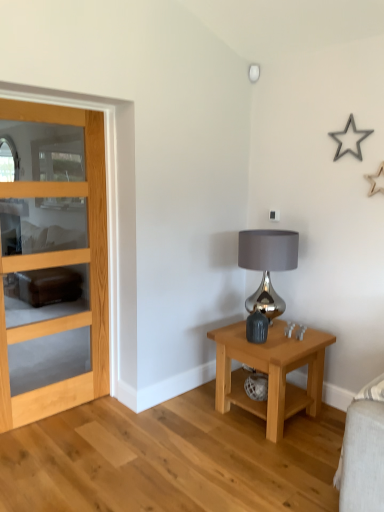
The image size is (384, 512). Describe the element at coordinates (267, 265) in the screenshot. I see `metallic gray lampshade at right` at that location.

Measure the distance between point (262, 407) and camera.

2.79 meters.

Locate an element on the screen. light wood/glass door at left is located at coordinates (62, 264).

Is satin silver lamp at upper center surrounded by light wood/finish nightstand at lower right?

That's incorrect, satin silver lamp at upper center is not inside light wood/finish nightstand at lower right.

In the image, there is a light wood/finish nightstand at lower right. At what (x,y) coordinates should I click in order to perform the action: click on lamp above it (from the image's perspective). Please return your answer as a coordinate pair (x, y). The height and width of the screenshot is (512, 384). Looking at the image, I should click on (254, 72).

How many degrees apart are the facing directions of light wood/finish nightstand at lower right and satin silver lamp at upper center?

The angle between the facing direction of light wood/finish nightstand at lower right and the facing direction of satin silver lamp at upper center is 0.569 degrees.

Who is more distant, metallic gray lampshade at right or satin silver lamp at upper center?

satin silver lamp at upper center is behind.

From the image's perspective, relative to satin silver lamp at upper center, is metallic gray lampshade at right above or below?

From the image's perspective, metallic gray lampshade at right appears below satin silver lamp at upper center.

Considering the sizes of metallic gray lampshade at right and satin silver lamp at upper center in the image, is metallic gray lampshade at right bigger or smaller than satin silver lamp at upper center?

Clearly, metallic gray lampshade at right is larger in size than satin silver lamp at upper center.

Is metallic gray lampshade at right far from satin silver lamp at upper center?

That's right, there is a large distance between metallic gray lampshade at right and satin silver lamp at upper center.

This screenshot has height=512, width=384. In the image, there is a satin silver lamp at upper center. Identify the location of door below it (from a real-world perspective). (62, 264).

From the image's perspective, is satin silver lamp at upper center located above or below light wood/glass door at left?

From the image's perspective, satin silver lamp at upper center appears above light wood/glass door at left.

Considering their positions, is satin silver lamp at upper center located in front of or behind light wood/glass door at left?

satin silver lamp at upper center is behind light wood/glass door at left.

Which point is more forward, (255, 65) or (12, 258)?

The point (12, 258) is closer.

Does light wood/finish nightstand at lower right have a greater width compared to light wood/glass door at left?

Yes.

Where is `door that is above the light wood/finish nightstand at lower right (from the image's perspective)`? door that is above the light wood/finish nightstand at lower right (from the image's perspective) is located at coordinates (62, 264).

Is light wood/finish nightstand at lower right inside or outside of light wood/glass door at left?

light wood/finish nightstand at lower right is outside light wood/glass door at left.

How many degrees apart are the facing directions of light wood/glass door at left and satin silver lamp at upper center?

The angular difference between light wood/glass door at left and satin silver lamp at upper center is 0.42 degrees.

From the picture: Visually, is light wood/glass door at left positioned to the left or to the right of satin silver lamp at upper center?

light wood/glass door at left is to the left of satin silver lamp at upper center.

Which of these two, light wood/glass door at left or satin silver lamp at upper center, stands taller?

light wood/glass door at left is taller.

Is point (278, 259) positioned behind point (13, 269)?

Yes, point (278, 259) is farther from viewer.

From a real-world perspective, which is physically above, metallic gray lampshade at right or light wood/glass door at left?

light wood/glass door at left, from a real-world perspective.

From the image's perspective, which one is positioned higher, metallic gray lampshade at right or light wood/glass door at left?

light wood/glass door at left.

Considering the relative sizes of metallic gray lampshade at right and light wood/glass door at left in the image provided, is metallic gray lampshade at right smaller than light wood/glass door at left?

Indeed, metallic gray lampshade at right has a smaller size compared to light wood/glass door at left.

The width and height of the screenshot is (384, 512). I want to click on table lamp behind the light wood/glass door at left, so click(267, 265).

Is light wood/glass door at left positioned beyond the bounds of metallic gray lampshade at right?

Absolutely, light wood/glass door at left is external to metallic gray lampshade at right.

Is the surface of light wood/glass door at left in direct contact with metallic gray lampshade at right?

No, light wood/glass door at left is not making contact with metallic gray lampshade at right.

From the image's perspective, is light wood/glass door at left located above or below metallic gray lampshade at right?

light wood/glass door at left is situated higher than metallic gray lampshade at right in the image.

Where is `nightstand below the satin silver lamp at upper center (from the image's perspective)`? The height and width of the screenshot is (512, 384). nightstand below the satin silver lamp at upper center (from the image's perspective) is located at coordinates (271, 372).

Identify the location of table lamp that appears below the satin silver lamp at upper center (from a real-world perspective). (267, 265).

Looking at the image, which one is located closer to metallic gray lampshade at right, satin silver lamp at upper center or light wood/glass door at left?

light wood/glass door at left.

Which object lies nearer to the anchor point metallic gray lampshade at right, light wood/glass door at left or light wood/finish nightstand at lower right?

light wood/finish nightstand at lower right is positioned closer to the anchor metallic gray lampshade at right.

Based on their spatial positions, is satin silver lamp at upper center or light wood/finish nightstand at lower right closer to light wood/glass door at left?

The object closer to light wood/glass door at left is light wood/finish nightstand at lower right.

Estimate the real-world distances between objects in this image. Which object is closer to light wood/finish nightstand at lower right, light wood/glass door at left or satin silver lamp at upper center?

light wood/glass door at left is positioned closer to the anchor light wood/finish nightstand at lower right.

Looking at the image, which one is located further to light wood/finish nightstand at lower right, metallic gray lampshade at right or satin silver lamp at upper center?

Based on the image, satin silver lamp at upper center appears to be further to light wood/finish nightstand at lower right.

Looking at this image, considering their positions, is light wood/glass door at left positioned further to metallic gray lampshade at right than satin silver lamp at upper center?

Among the two, satin silver lamp at upper center is located further to metallic gray lampshade at right.

Considering their positions, is light wood/glass door at left positioned closer to satin silver lamp at upper center than light wood/finish nightstand at lower right?

The object closer to satin silver lamp at upper center is light wood/glass door at left.

From the image, which object appears to be nearer to satin silver lamp at upper center, light wood/glass door at left or metallic gray lampshade at right?

metallic gray lampshade at right is closer to satin silver lamp at upper center.

Find the location of a particular element. door that lies between satin silver lamp at upper center and metallic gray lampshade at right from top to bottom is located at coordinates pyautogui.click(x=62, y=264).

Where is `table lamp located between light wood/glass door at left and light wood/finish nightstand at lower right in the left-right direction`? table lamp located between light wood/glass door at left and light wood/finish nightstand at lower right in the left-right direction is located at coordinates (267, 265).

This screenshot has width=384, height=512. In order to click on door between satin silver lamp at upper center and light wood/finish nightstand at lower right in the up-down direction in this screenshot , I will do `click(62, 264)`.

Find the location of a particular element. This screenshot has height=512, width=384. table lamp between satin silver lamp at upper center and light wood/finish nightstand at lower right from top to bottom is located at coordinates (267, 265).